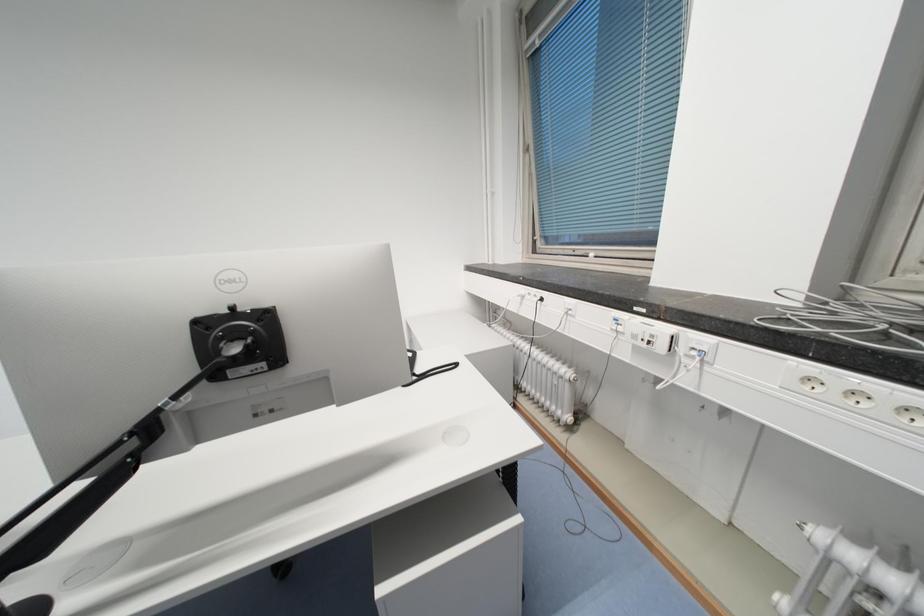
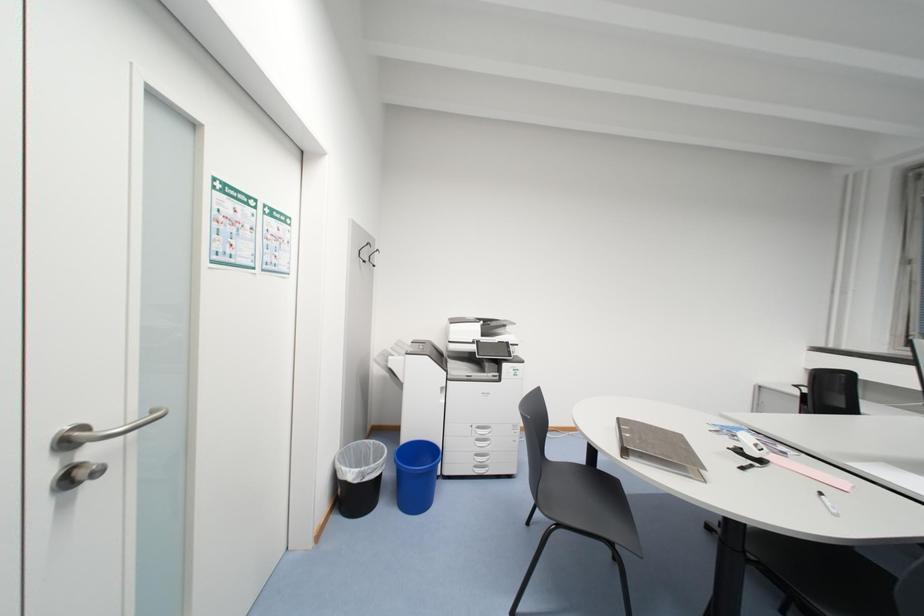
Which direction would the cameraman need to move to produce the second image?

The cameraman moved toward left, backward.